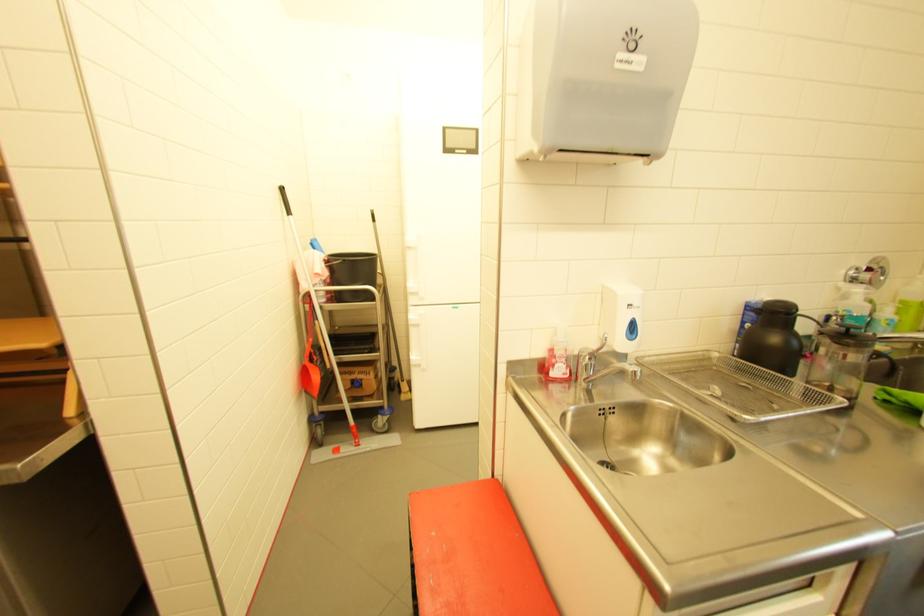
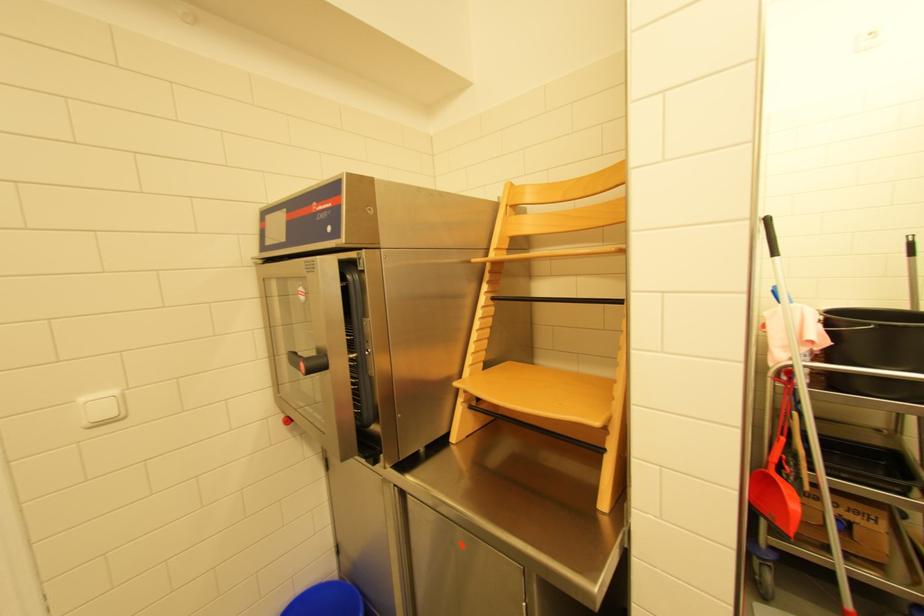
Locate, in the second image, the point that corresponds to (x=52, y=345) in the first image.

(603, 424)